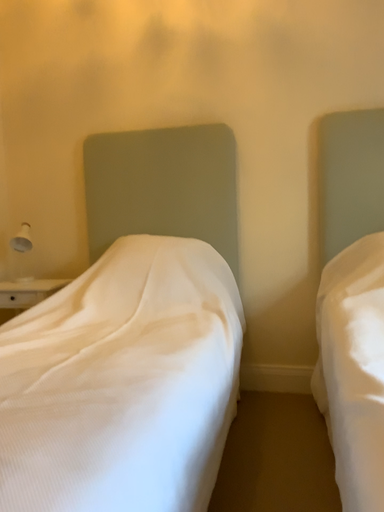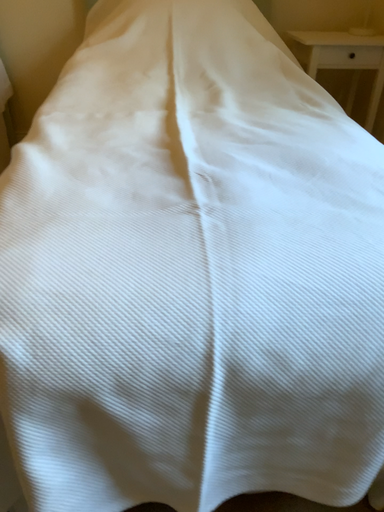
Question: Which way did the camera rotate in the video?

Choices:
 (A) rotated right
 (B) rotated left

Answer: (A)